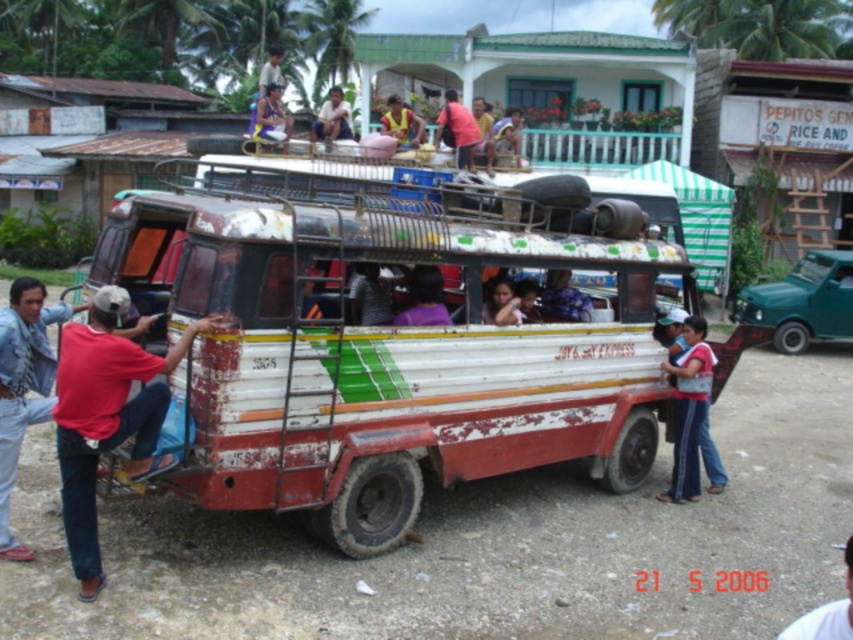
Between point (207, 337) and point (688, 339), which one is positioned in front?

Point (207, 337) is more forward.

Does rusty metal tour bus at center have a greater height compared to denim pants at lower right?

Indeed, rusty metal tour bus at center has a greater height compared to denim pants at lower right.

Does point (492, 442) come closer to viewer compared to point (700, 397)?

Yes, point (492, 442) is in front of point (700, 397).

This screenshot has width=853, height=640. In order to click on rusty metal tour bus at center in this screenshot , I will do `click(390, 340)`.

Does green matte car at right have a lesser height compared to white fabric shirt at center?

In fact, green matte car at right may be taller than white fabric shirt at center.

Who is higher up, green matte car at right or white fabric shirt at center?

Positioned higher is green matte car at right.

Between point (741, 291) and point (817, 611), which one is positioned in front?

Point (817, 611)

This screenshot has height=640, width=853. What are the coordinates of `green matte car at right` in the screenshot? It's located at (802, 301).

Which of these two, matte yellow shirt at center or matte purple shirt at center, stands taller?

Standing taller between the two is matte yellow shirt at center.

Is matte yellow shirt at center shorter than matte purple shirt at center?

In fact, matte yellow shirt at center may be taller than matte purple shirt at center.

Image resolution: width=853 pixels, height=640 pixels. What do you see at coordinates (332, 118) in the screenshot?
I see `matte yellow shirt at center` at bounding box center [332, 118].

Find the location of a particular element. matte yellow shirt at center is located at coordinates (332, 118).